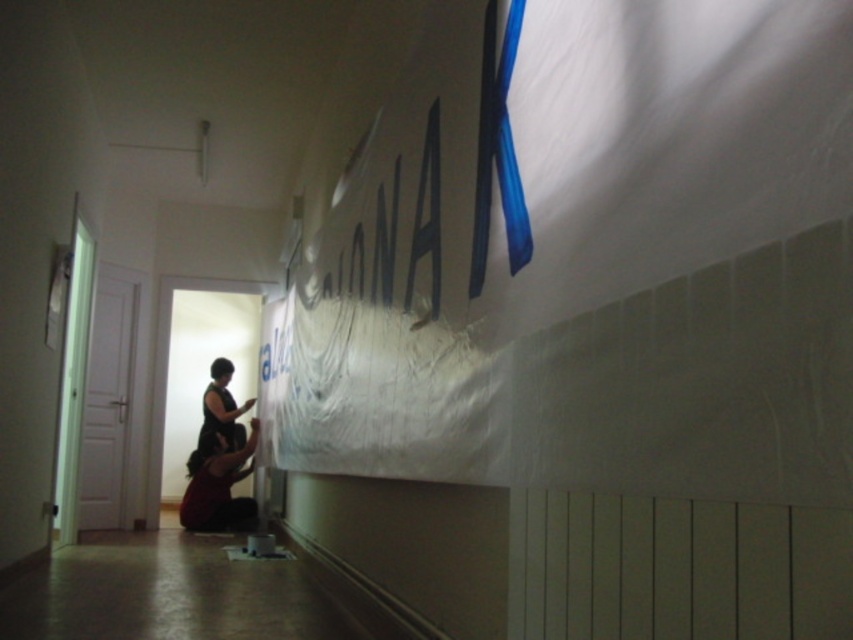
You are standing in the hallway where the banner is being set up. There is a point marked at coordinates (x=218, y=486). What object is located at that point?

The dark red fabric at lower center is located at point (x=218, y=486).

Based on the photo, you are a tailor observing the dark red fabric at lower center and the dark brown fabric dress at center in the image. Which fabric is positioned lower in the scene?

The dark red fabric at lower center is positioned below the dark brown fabric dress at center, so it is lower in the scene.